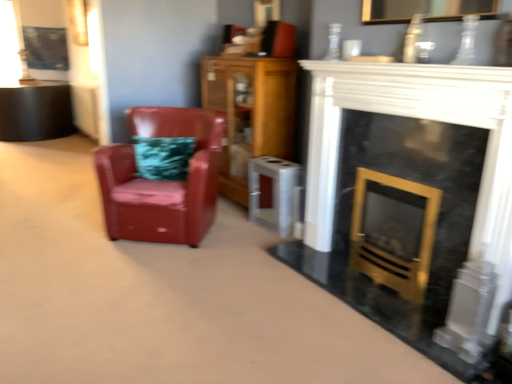
Where is `vacant area that lies in front of glossy leather armchair at left`? vacant area that lies in front of glossy leather armchair at left is located at coordinates click(x=137, y=274).